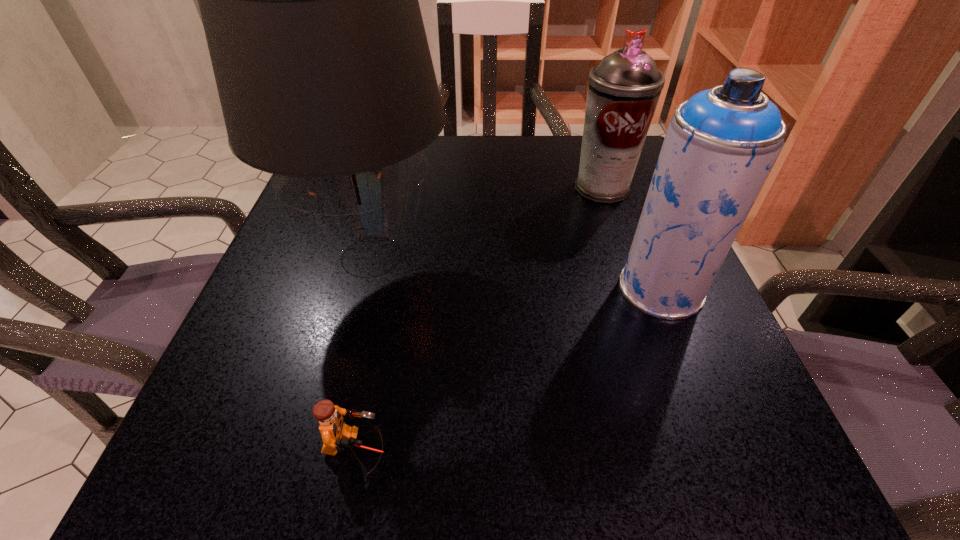
You are a GUI agent. You are given a task and a screenshot of the screen. Output one action in this format:
    pyautogui.click(x=<x>, y=<y>)
    Task: Click on the object located in the near edge section of the desktop
    This screenshot has width=960, height=540.
    Given the screenshot: What is the action you would take?
    pyautogui.click(x=337, y=436)

This screenshot has height=540, width=960. I want to click on object that is positioned at the left edge, so click(x=309, y=1).

Find the location of a particular element. object present at the far right corner is located at coordinates tap(624, 88).

In the image, there is a desktop. At what (x,y) coordinates should I click in order to perform the action: click on blank space at the far edge. Please return your answer as a coordinate pair (x, y). Looking at the image, I should click on (548, 156).

The image size is (960, 540). Find the location of `vacant space at the left edge`. vacant space at the left edge is located at coordinates (347, 304).

The width and height of the screenshot is (960, 540). I want to click on free region at the right edge, so click(x=614, y=217).

You are a GUI agent. You are given a task and a screenshot of the screen. Output one action in this format:
    pyautogui.click(x=<x>, y=<y>)
    Task: Click on the vacant space at the far right corner of the desktop
    The image size is (960, 540).
    Given the screenshot: What is the action you would take?
    pyautogui.click(x=568, y=138)

I want to click on free space between the tallest object and the nearest object, so click(x=364, y=353).

This screenshot has height=540, width=960. I want to click on blank region between the nearer aerosol can and the farthest object, so click(x=631, y=238).

The width and height of the screenshot is (960, 540). I want to click on free space between the farthest object and the nearest object, so [x=479, y=319].